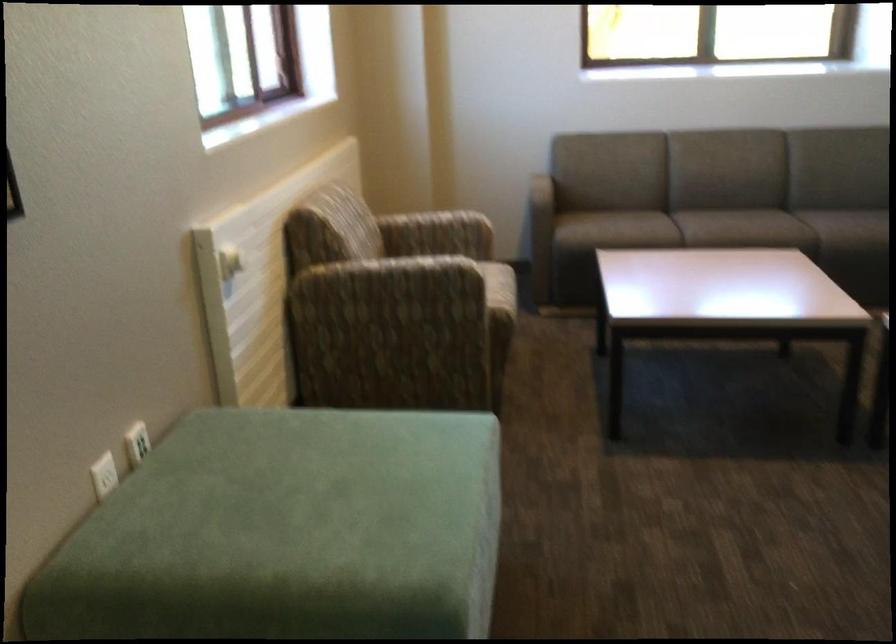
Describe the element at coordinates (229, 263) in the screenshot. The width and height of the screenshot is (896, 644). I see `the white radiator knob` at that location.